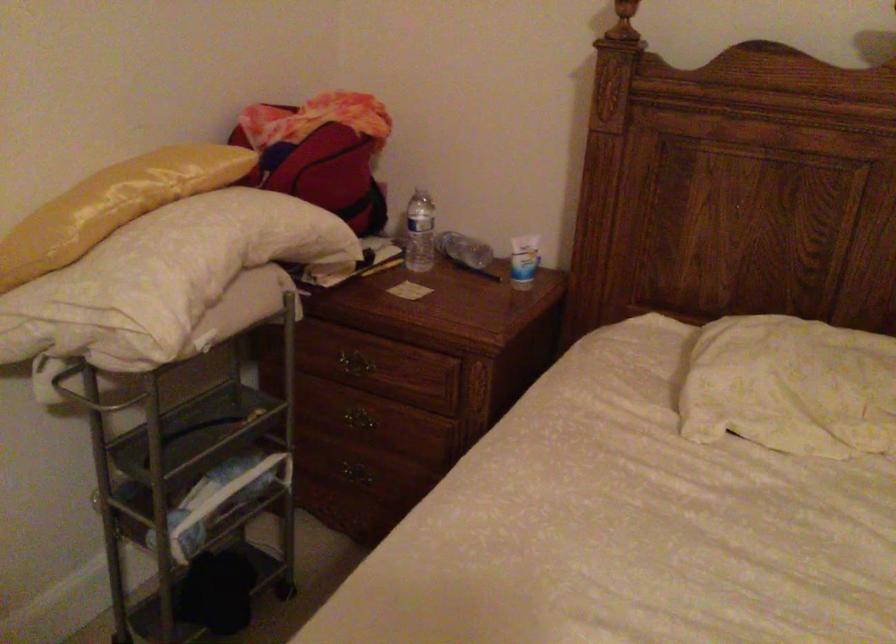
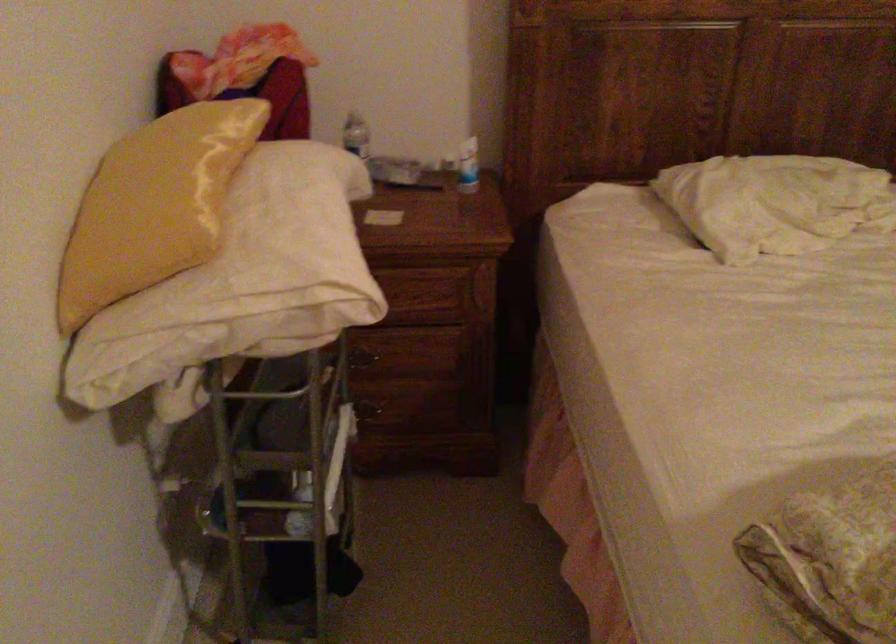
The point at (791,382) is marked in the first image. Where is the corresponding point in the second image?

(774, 202)